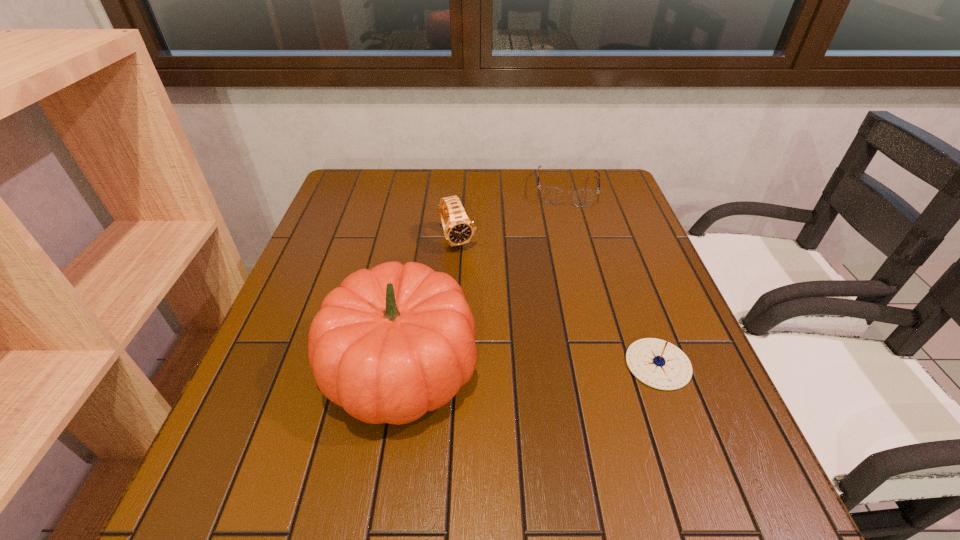
Where is `empty space between the compass and the pumpkin`? The image size is (960, 540). empty space between the compass and the pumpkin is located at coordinates (530, 366).

You are a GUI agent. You are given a task and a screenshot of the screen. Output one action in this format:
    pyautogui.click(x=<x>, y=<y>)
    Task: Click on the unoccupied area between the second farthest object and the farthest object
    This screenshot has height=540, width=960.
    Given the screenshot: What is the action you would take?
    [x=512, y=215]

The image size is (960, 540). Find the location of `vacant space in between the compass and the pumpkin`. vacant space in between the compass and the pumpkin is located at coordinates (530, 366).

The height and width of the screenshot is (540, 960). Identify the location of free space between the watch and the farthest object. (512, 215).

Find the location of `object that is the second closest to the farthest object`. object that is the second closest to the farthest object is located at coordinates (391, 343).

Identify which object is the third nearest to the spectacles. Please provide its 2D coordinates. Your answer should be formatted as a tuple, i.e. [(x, y)], where the tuple contains the x and y coordinates of a point satisfying the conditions above.

[(657, 363)]

Identify the location of vacant position in the image that satisfies the following two spatial constraints: 1. on the back side of the third shortest object; 2. on the right side of the tallest object. click(421, 240).